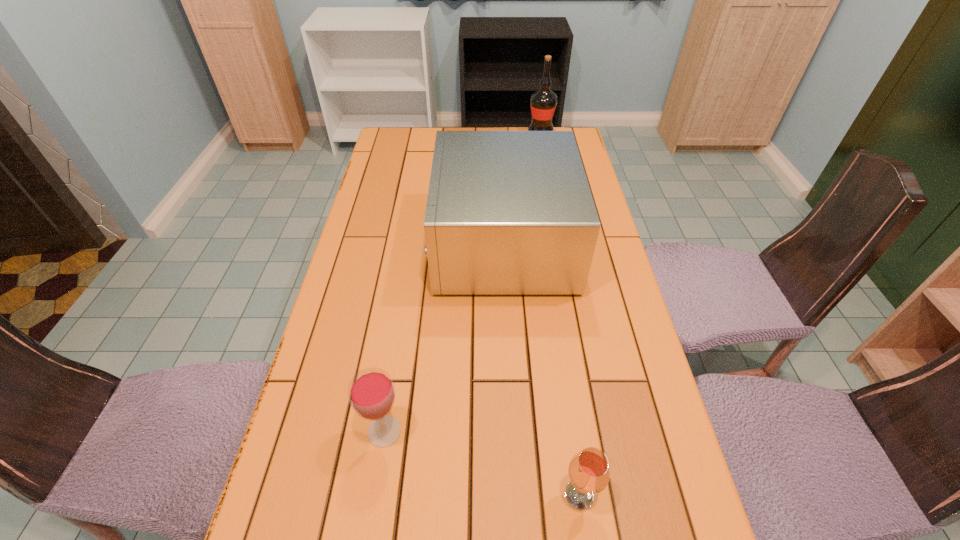
Locate an element on the screen. The height and width of the screenshot is (540, 960). the farthest object is located at coordinates (543, 102).

This screenshot has width=960, height=540. In order to click on the tallest object in this screenshot , I will do `click(543, 102)`.

This screenshot has width=960, height=540. What are the coordinates of `microwave oven` in the screenshot? It's located at (508, 212).

Identify the location of the third nearest object. The width and height of the screenshot is (960, 540). (508, 212).

Where is `the third farthest object`? This screenshot has width=960, height=540. the third farthest object is located at coordinates (371, 392).

This screenshot has height=540, width=960. In order to click on the farther wineglass in this screenshot , I will do `click(371, 392)`.

Where is `the shorter wineglass`? This screenshot has height=540, width=960. the shorter wineglass is located at coordinates (588, 471).

The width and height of the screenshot is (960, 540). I want to click on the nearer wineglass, so click(588, 471).

The image size is (960, 540). I want to click on free space located 0.370m on the left of the wine bottle, so click(x=436, y=132).

In order to click on free space located with the door open on the second tallest object in this screenshot , I will do `click(360, 243)`.